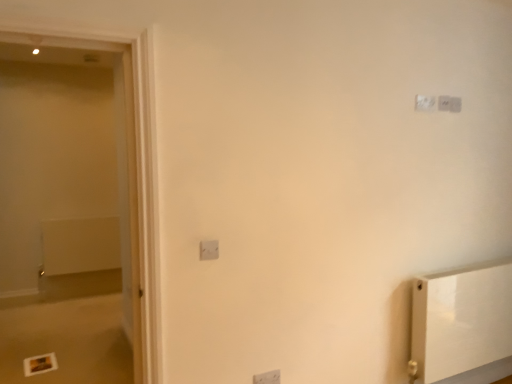
Question: Is white plastic light switch at center, which is counted as the first light switch, starting from the front, at the back of white glossy screen door at left?

Choices:
 (A) no
 (B) yes

Answer: (A)

Question: Does white glossy screen door at left have a larger size compared to white plastic light switch at center, the 4th light switch viewed from the back?

Choices:
 (A) yes
 (B) no

Answer: (A)

Question: Are white glossy screen door at left and white plastic light switch at center, marked as the first light switch in a left-to-right arrangement, located far from each other?

Choices:
 (A) yes
 (B) no

Answer: (B)

Question: Is white glossy screen door at left taller than white plastic light switch at center, which appears as the third light switch when viewed from the top?

Choices:
 (A) yes
 (B) no

Answer: (A)

Question: Does white glossy screen door at left lie behind white plastic light switch at center, the 2th light switch in the bottom-to-top sequence?

Choices:
 (A) yes
 (B) no

Answer: (B)

Question: From a real-world perspective, is white glossy screen door at left positioned under white plastic light switch at center, the 4th light switch positioned from the right, based on gravity?

Choices:
 (A) yes
 (B) no

Answer: (B)

Question: Is white matte radiator at left wider than white plastic light switch at center, the 4th light switch in the top-to-bottom sequence?

Choices:
 (A) no
 (B) yes

Answer: (B)

Question: From the image's perspective, does white matte radiator at left appear higher than white plastic light switch at center, acting as the 3th light switch starting from the back?

Choices:
 (A) yes
 (B) no

Answer: (A)

Question: Is white matte radiator at left oriented towards white plastic light switch at center, which is the third light switch in right-to-left order?

Choices:
 (A) no
 (B) yes

Answer: (B)

Question: Would you say white plastic light switch at center, arranged as the 2th light switch when viewed from the left, is part of white matte radiator at left's contents?

Choices:
 (A) yes
 (B) no

Answer: (B)

Question: Can you confirm if white matte radiator at left is bigger than white plastic light switch at center, the 4th light switch in the top-to-bottom sequence?

Choices:
 (A) yes
 (B) no

Answer: (A)

Question: Does white matte radiator at left have a lesser width compared to white plastic light switch at center, positioned as the second light switch in front-to-back order?

Choices:
 (A) yes
 (B) no

Answer: (B)

Question: Can you confirm if white plastic light switch at center, placed as the first light switch when sorted from bottom to top, is thinner than white matte radiator at left?

Choices:
 (A) no
 (B) yes

Answer: (B)